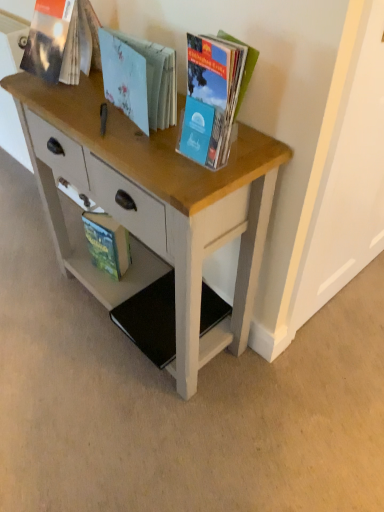
This screenshot has width=384, height=512. In order to click on free space in front of light blue paper book at center, the 2th book when ordered from front to back in this screenshot , I will do coord(148,150).